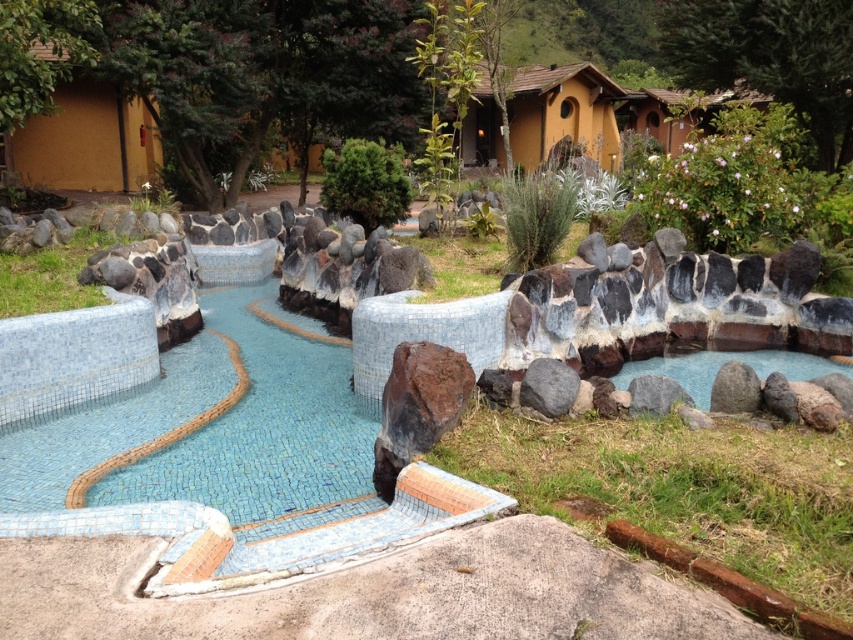
You are standing at the camera position and want to pick up the brown rough rock at center. Can you reach it without moving your feet?

The brown rough rock at center is 3.80 meters away from the camera position. Since the average human arm length is about 0.7 meters, you cannot reach it without moving your feet.

You are standing in the pool area and want to take a photo of both the blue mosaic pool at center and the smooth stone pond at right. Which one should you focus on first to ensure both are in the frame?

You should focus on the blue mosaic pool at center first since it is closer to you than the smooth stone pond at right, allowing both to be captured in the frame when properly composed.